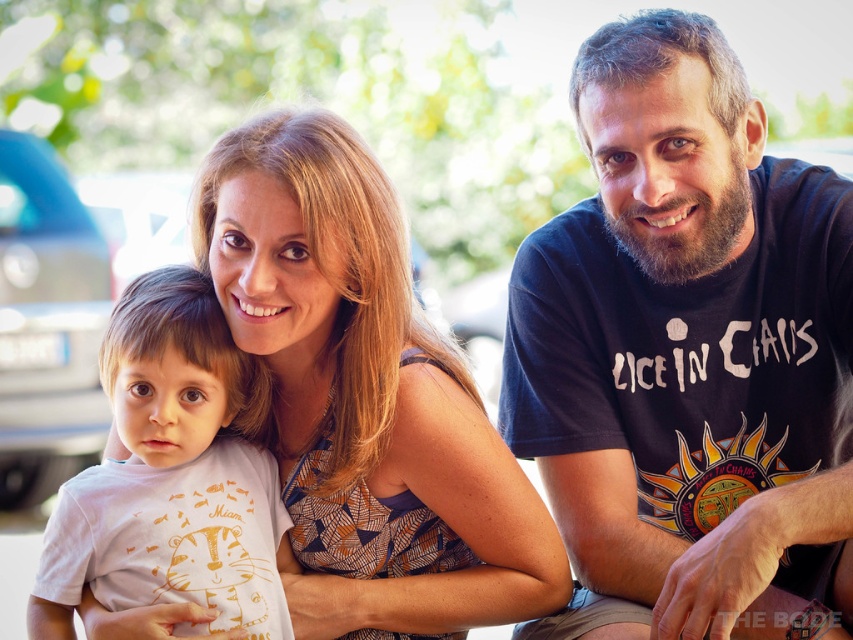
Which is above, dark blue t-shirt at right or white cotton shirt at left?

dark blue t-shirt at right is above.

Which is in front, point (775, 364) or point (222, 552)?

Point (222, 552) is more forward.

The height and width of the screenshot is (640, 853). In order to click on dark blue t-shirt at right in this screenshot , I will do `click(686, 355)`.

Locate an element on the screen. matte white shirt at center is located at coordinates (364, 397).

Does point (239, 208) come closer to viewer compared to point (144, 588)?

No, it is behind (144, 588).

Is point (457, 541) more distant than point (186, 451)?

Yes, it is behind point (186, 451).

Locate an element on the screen. The width and height of the screenshot is (853, 640). matte white shirt at center is located at coordinates coord(364,397).

Is dark blue t-shirt at right positioned before matte white shirt at center?

Yes, dark blue t-shirt at right is closer to the viewer.

Image resolution: width=853 pixels, height=640 pixels. Describe the element at coordinates (686, 355) in the screenshot. I see `dark blue t-shirt at right` at that location.

Find the location of a particular element. dark blue t-shirt at right is located at coordinates (686, 355).

Image resolution: width=853 pixels, height=640 pixels. Find the location of `dark blue t-shirt at right`. dark blue t-shirt at right is located at coordinates (686, 355).